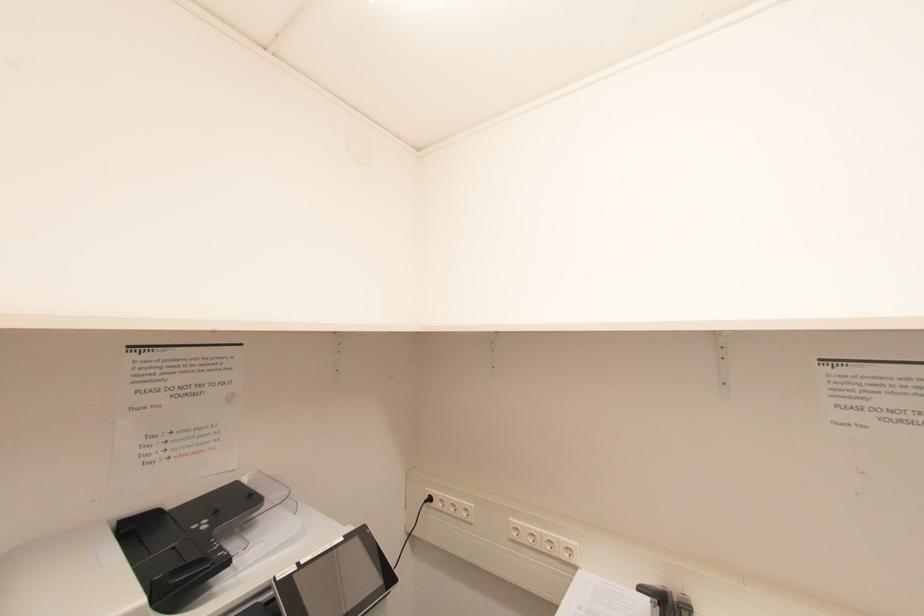
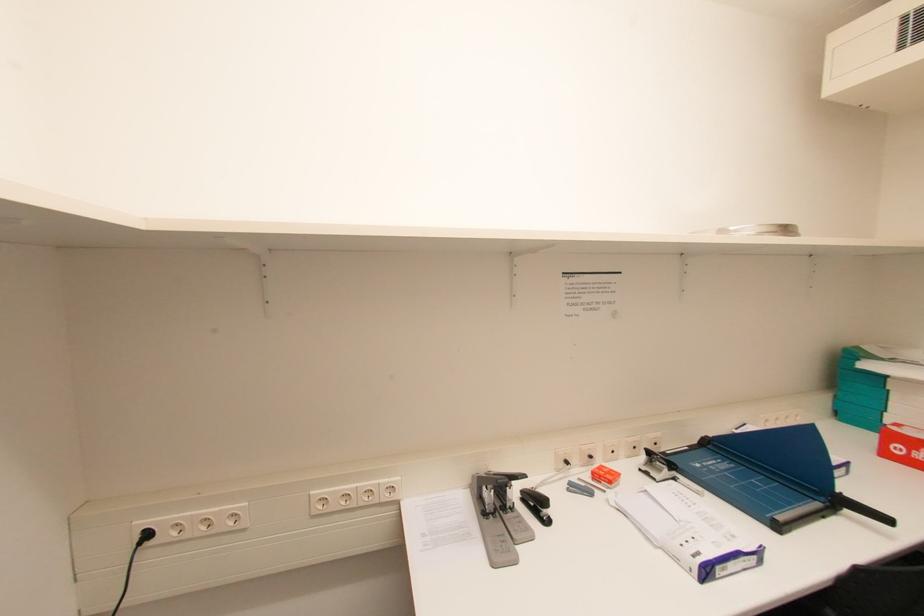
Question: The camera is either moving clockwise (left) or counter-clockwise (right) around the object. The first image is from the beginning of the video and the second image is from the end. Is the camera moving left or right when shooting the video?

Choices:
 (A) Left
 (B) Right

Answer: (A)